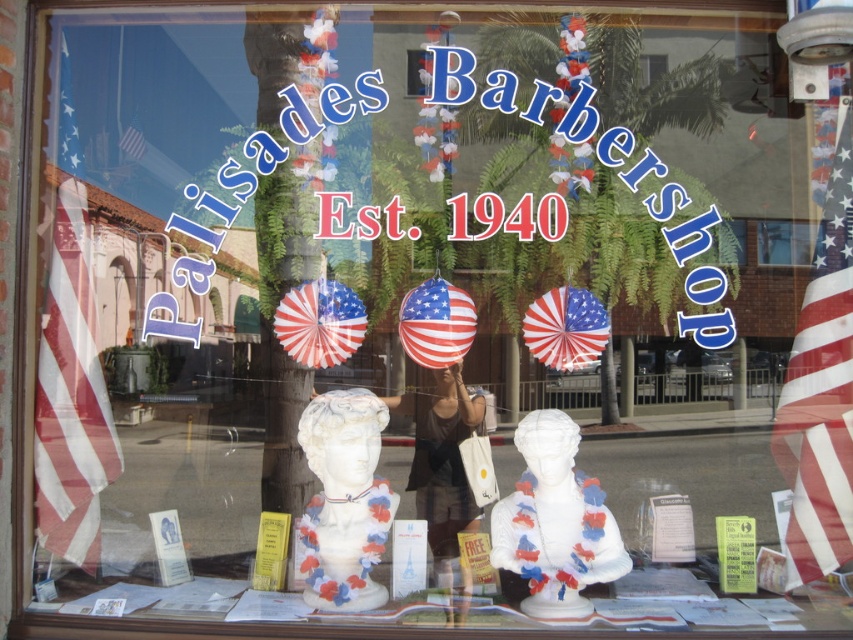
You are standing in front of the Palisades Barbershop storefront window. There is a point at coordinates point (836, 221). Can you determine how far this point is from your current position?

The point at point (836, 221) is 2.07 meters away from the camera, so the distance from your current position to the point is 2.07 meters.